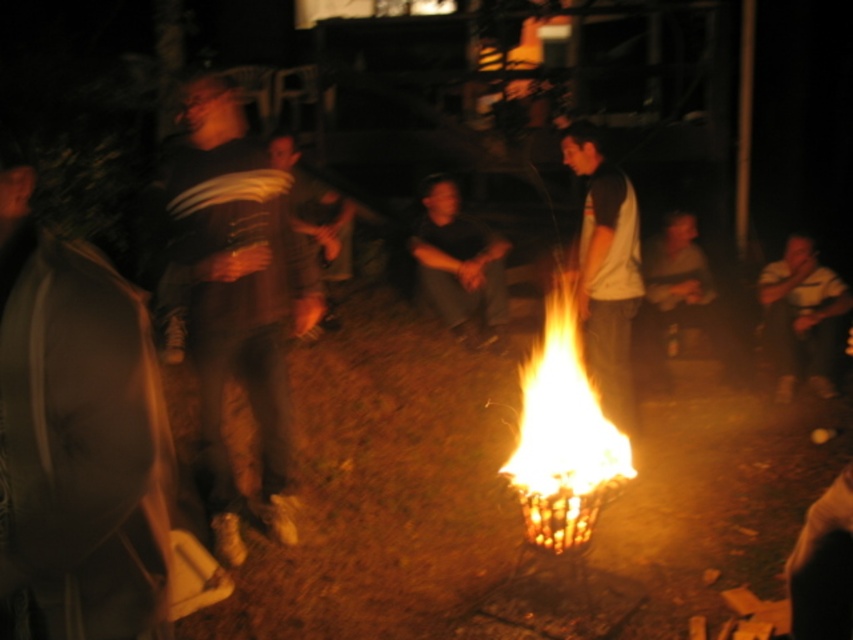
Question: Where is matte gray jacket at left located in relation to white cotton shirt at center in the image?

Choices:
 (A) below
 (B) above

Answer: (A)

Question: Which point appears closest to the camera in this image?

Choices:
 (A) (689, 298)
 (B) (785, 314)
 (C) (28, 390)
 (D) (548, 442)

Answer: (C)

Question: Considering the relative positions of dark brown leather shoes at left and flamewoodenbasket at center in the image provided, where is dark brown leather shoes at left located with respect to flamewoodenbasket at center?

Choices:
 (A) right
 (B) left

Answer: (B)

Question: Estimate the real-world distances between objects in this image. Which object is closer to the matte gray jacket at left?

Choices:
 (A) dark brown leather shoes at left
 (B) white cotton shirt at center
 (C) flamewoodenbasket at center
 (D) yellow striped shirt at right

Answer: (A)

Question: Based on their relative distances, which object is nearer to the white cotton shirt at center?

Choices:
 (A) matte gray jacket at left
 (B) black matte shirt at center
 (C) dark gray shirt at center

Answer: (C)

Question: Is matte gray jacket at left wider than dark brown leather shoes at left?

Choices:
 (A) yes
 (B) no

Answer: (B)